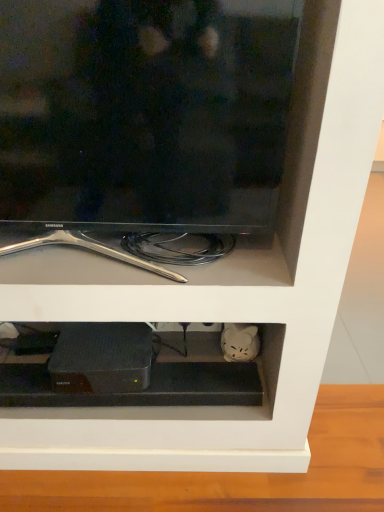
Question: Considering the positions of black glossy tv at upper center and black matte device at center in the image, is black glossy tv at upper center taller or shorter than black matte device at center?

Choices:
 (A) short
 (B) tall

Answer: (B)

Question: Looking at the image, does black glossy tv at upper center seem bigger or smaller compared to black matte device at center?

Choices:
 (A) big
 (B) small

Answer: (A)

Question: Which object is positioned farthest from the black matte device at center?

Choices:
 (A) black matte router at lower center
 (B) black glossy tv at upper center

Answer: (B)

Question: Which object is positioned farthest from the black glossy tv at upper center?

Choices:
 (A) black matte router at lower center
 (B) black matte device at center

Answer: (A)